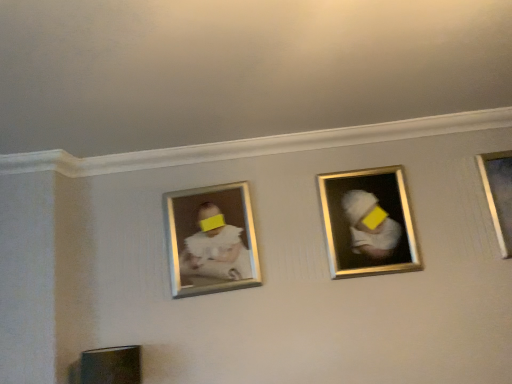
Question: Is metallic silver picture frame at right, positioned as the first picture frame in right-to-left order, facing away from white matte baby portrait at center?

Choices:
 (A) yes
 (B) no

Answer: (B)

Question: Considering the relative sizes of metallic silver picture frame at right, arranged as the second picture frame when viewed from the left, and white matte baby portrait at center in the image provided, is metallic silver picture frame at right, arranged as the second picture frame when viewed from the left, smaller than white matte baby portrait at center?

Choices:
 (A) yes
 (B) no

Answer: (A)

Question: From a real-world perspective, is metallic silver picture frame at right, arranged as the second picture frame when viewed from the left, under white matte baby portrait at center?

Choices:
 (A) no
 (B) yes

Answer: (B)

Question: Does metallic silver picture frame at right, positioned as the first picture frame in right-to-left order, have a greater width compared to white matte baby portrait at center?

Choices:
 (A) no
 (B) yes

Answer: (A)

Question: Is the depth of metallic silver picture frame at right, arranged as the second picture frame when viewed from the left, less than that of white matte baby portrait at center?

Choices:
 (A) no
 (B) yes

Answer: (A)

Question: Is metallic silver picture frame at right, arranged as the second picture frame when viewed from the left, facing towards white matte baby portrait at center?

Choices:
 (A) no
 (B) yes

Answer: (A)

Question: Can you confirm if gold metallic picture frame at center, arranged as the 1th picture frame when viewed from the left, is shorter than metallic silver picture frame at right, positioned as the first picture frame in right-to-left order?

Choices:
 (A) no
 (B) yes

Answer: (A)

Question: Is gold metallic picture frame at center, the 2th picture frame in the right-to-left sequence, facing towards metallic silver picture frame at right, arranged as the second picture frame when viewed from the left?

Choices:
 (A) no
 (B) yes

Answer: (A)

Question: Considering the relative sizes of gold metallic picture frame at center, the 2th picture frame in the right-to-left sequence, and metallic silver picture frame at right, arranged as the second picture frame when viewed from the left, in the image provided, is gold metallic picture frame at center, the 2th picture frame in the right-to-left sequence, taller than metallic silver picture frame at right, arranged as the second picture frame when viewed from the left,?

Choices:
 (A) yes
 (B) no

Answer: (A)

Question: Does gold metallic picture frame at center, the 2th picture frame in the right-to-left sequence, touch metallic silver picture frame at right, arranged as the second picture frame when viewed from the left?

Choices:
 (A) yes
 (B) no

Answer: (B)

Question: Is gold metallic picture frame at center, arranged as the 1th picture frame when viewed from the left, to the right of metallic silver picture frame at right, positioned as the first picture frame in right-to-left order, from the viewer's perspective?

Choices:
 (A) yes
 (B) no

Answer: (B)

Question: Is gold metallic picture frame at center, the 2th picture frame in the right-to-left sequence, positioned in front of metallic silver picture frame at right, positioned as the first picture frame in right-to-left order?

Choices:
 (A) no
 (B) yes

Answer: (B)

Question: Is white matte baby portrait at center bigger than metallic silver picture frame at right, positioned as the first picture frame in right-to-left order?

Choices:
 (A) yes
 (B) no

Answer: (A)